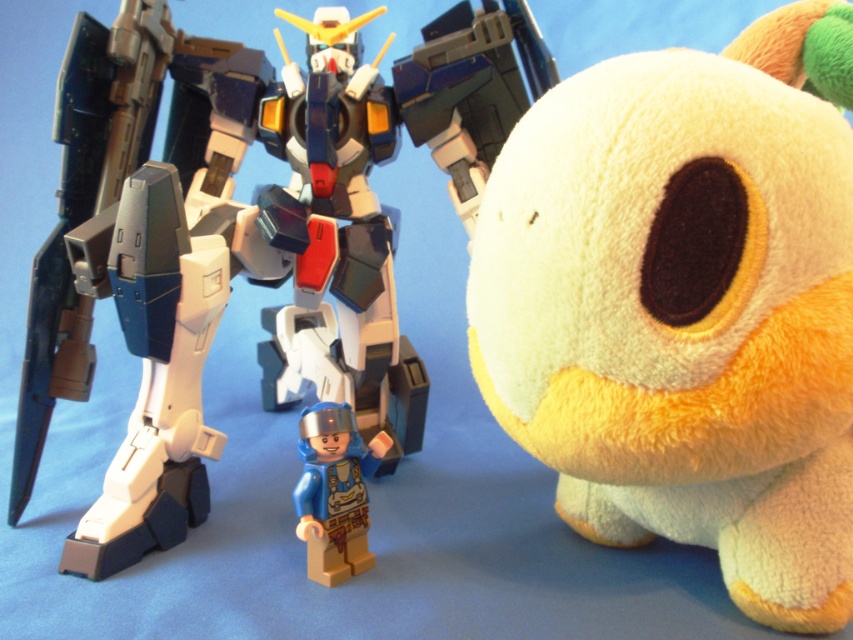
You are a collector who wants to display both the shiny plastic robot at center and the blue plastic minifigure at center on a shelf. Given that the shelf has limited vertical space, which object will require more upward space due to its height?

The shiny plastic robot at center requires more upward space because it has a greater height compared to the blue plastic minifigure at center.

You are setting up a display for a toy store and have two items to place on a shelf. You have a yellow plush toy at center and a shiny plastic robot at center. The store requires that these two items must be at least 24 inches apart to avoid overcrowding. Based on their current positions, will they meet the store requirement?

The yellow plush toy at center is 22.75 inches from the shiny plastic robot at center, which is less than the required 24 inches. Therefore, they do not meet the store requirement and need to be moved further apart.